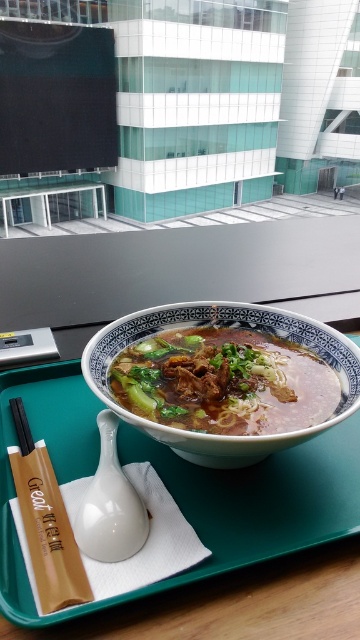
Question: Which is nearer to the black wood chopsticks at upper left?

Choices:
 (A) green plastic tray at center
 (B) brown matte noodles at center

Answer: (A)

Question: Which object appears farthest from the camera in this image?

Choices:
 (A) brown matte noodles at center
 (B) black wood chopsticks at upper left
 (C) green plastic tray at center

Answer: (B)

Question: Does green plastic tray at center appear on the right side of brown matte noodles at center?

Choices:
 (A) yes
 (B) no

Answer: (B)

Question: Can you confirm if brown matte noodles at center is positioned to the left of black wood chopsticks at upper left?

Choices:
 (A) yes
 (B) no

Answer: (B)

Question: Estimate the real-world distances between objects in this image. Which object is closer to the green plastic tray at center?

Choices:
 (A) brown matte noodles at center
 (B) black wood chopsticks at upper left

Answer: (A)

Question: In this image, where is green plastic tray at center located relative to black wood chopsticks at upper left?

Choices:
 (A) right
 (B) left

Answer: (A)